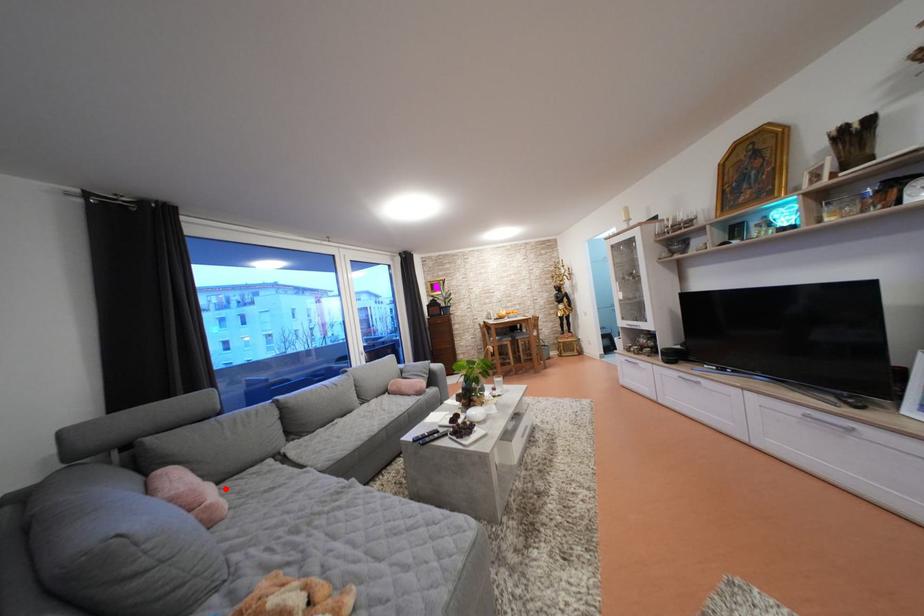
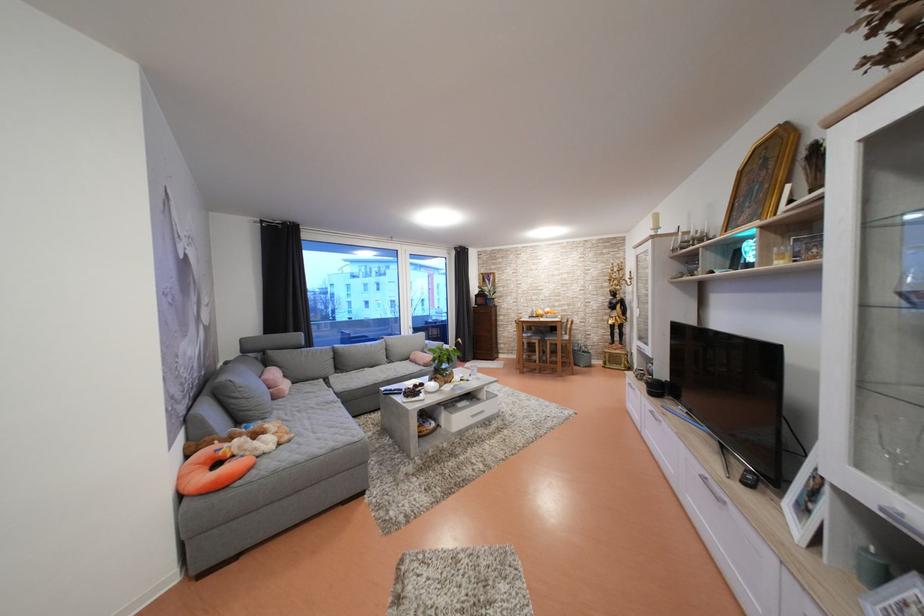
Locate, in the second image, the point that corresponds to the highlighted location in the first image.

(300, 387)